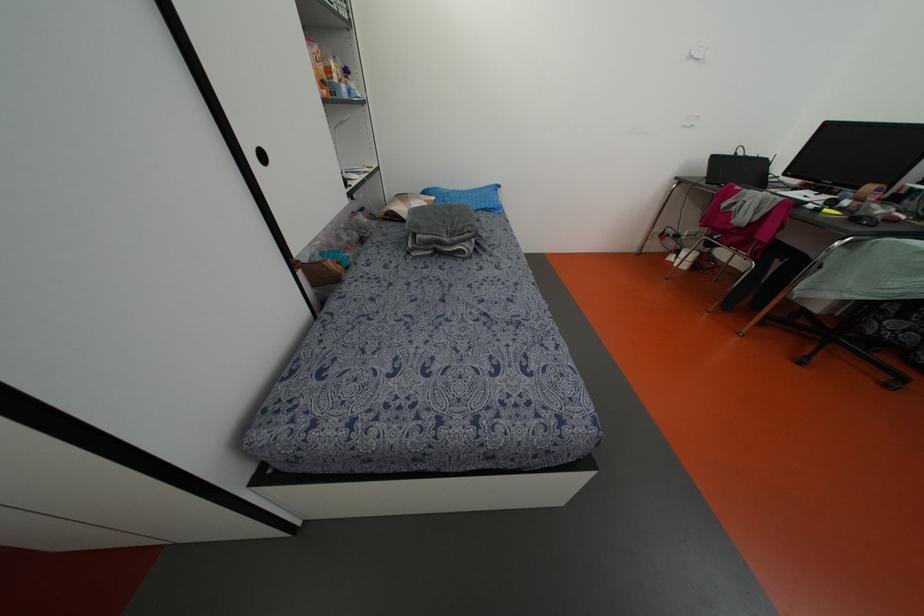
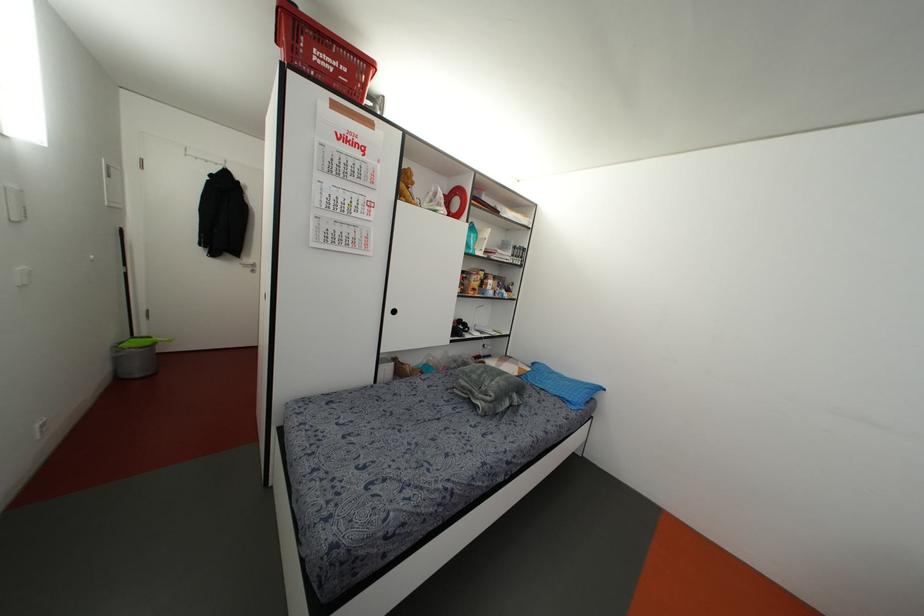
Where in the second image is the point corresponding to pixel 262 156 from the first image?

(394, 310)